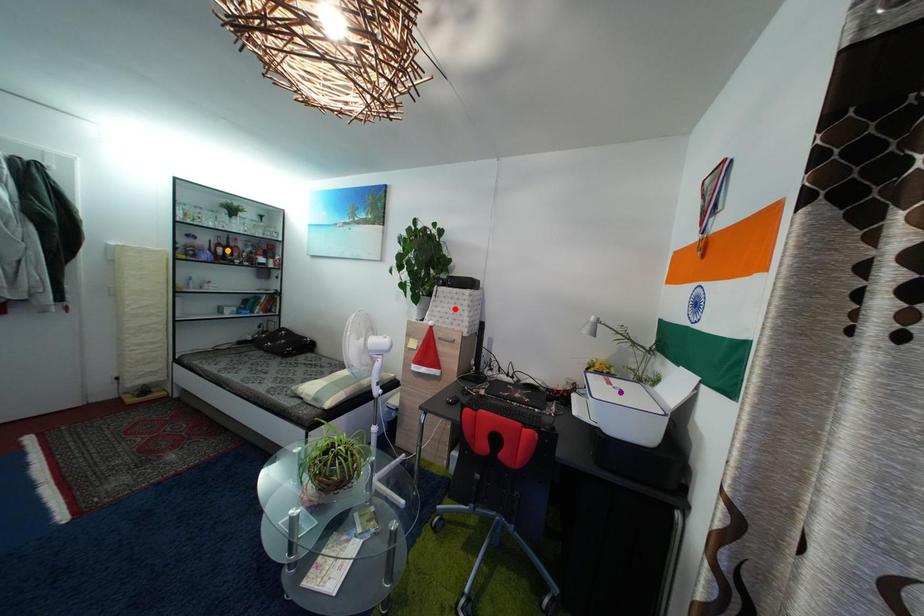
Order these from nearest to farthest:
red point | purple point | orange point

purple point
red point
orange point